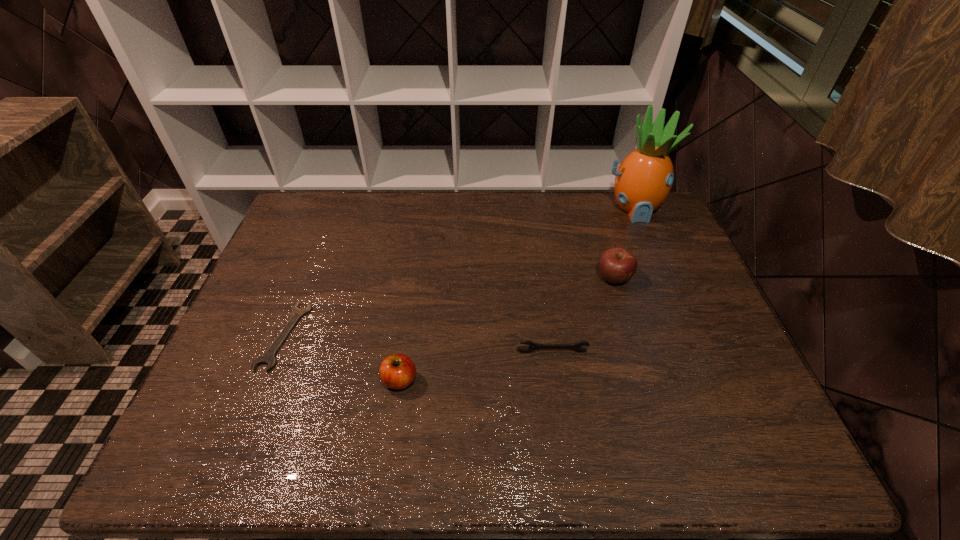
Image resolution: width=960 pixels, height=540 pixels. Find the location of `the tallest object`. the tallest object is located at coordinates (644, 179).

What are the coordinates of `the farthest object` in the screenshot? It's located at (644, 179).

Image resolution: width=960 pixels, height=540 pixels. Identify the location of the farther apple. (617, 265).

At what (x,y) coordinates should I click in order to perform the action: click on the fourth nearest object. Please return your answer as a coordinate pair (x, y). Looking at the image, I should click on (617, 265).

The image size is (960, 540). I want to click on the left apple, so click(x=398, y=371).

Locate an element on the screen. the second object from left to right is located at coordinates (398, 371).

The width and height of the screenshot is (960, 540). I want to click on the right wrench, so click(533, 346).

Locate an element on the screen. The height and width of the screenshot is (540, 960). the second shortest object is located at coordinates (533, 346).

The image size is (960, 540). I want to click on the leftmost object, so click(268, 357).

Locate an element on the screen. The width and height of the screenshot is (960, 540). the left wrench is located at coordinates (268, 357).